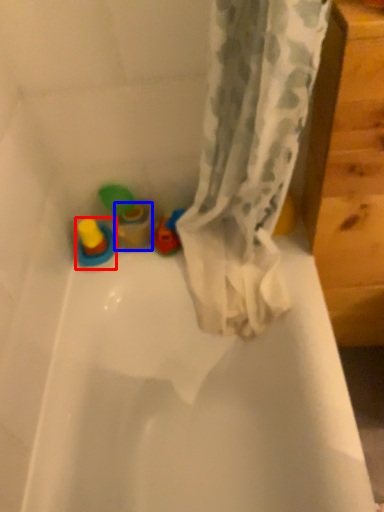
Question: Which object is closer to the camera taking this photo, toy (highlighted by a red box) or toy (highlighted by a blue box)?

Choices:
 (A) toy
 (B) toy

Answer: (A)